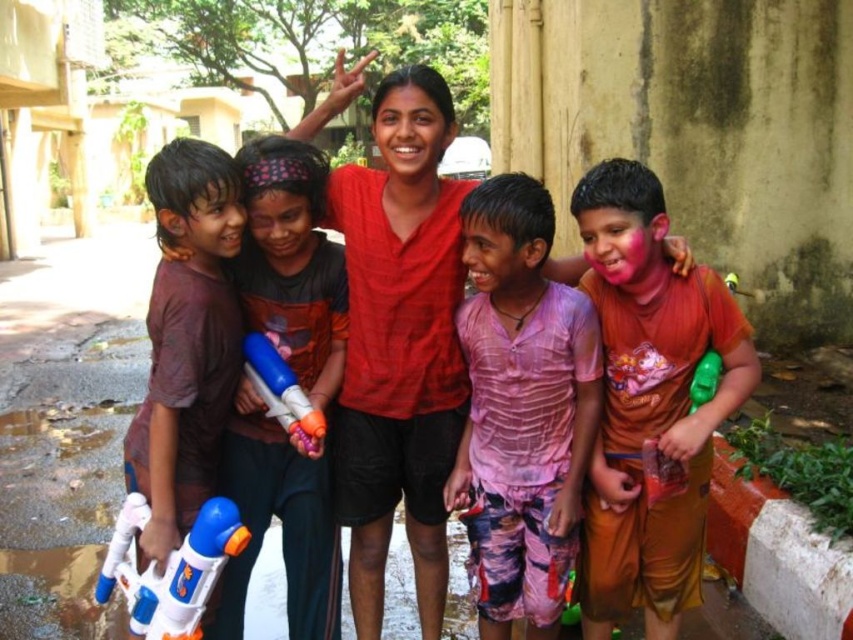
Can you confirm if orange fabric shirt at center is taller than blue plastic water gun at center?

Correct, orange fabric shirt at center is much taller as blue plastic water gun at center.

Does orange fabric shirt at center have a lesser height compared to blue plastic water gun at center?

In fact, orange fabric shirt at center may be taller than blue plastic water gun at center.

Does point (584, 284) come closer to viewer compared to point (265, 349)?

No, it is behind (265, 349).

The image size is (853, 640). What are the coordinates of `orange fabric shirt at center` in the screenshot? It's located at (648, 404).

Is point (210, 312) positioned after point (296, 380)?

No, (210, 312) is closer to viewer.

Image resolution: width=853 pixels, height=640 pixels. Find the location of `brown matte water gun at left`. brown matte water gun at left is located at coordinates (187, 339).

Locate an element on the screen. The height and width of the screenshot is (640, 853). brown matte water gun at left is located at coordinates (187, 339).

Where is `brown matte water gun at left`? brown matte water gun at left is located at coordinates (187, 339).

Who is higher up, pink fabric shirt at center or matte brown shirt at center?

matte brown shirt at center is above.

Does point (554, 429) come behind point (257, 547)?

No, it is not.

Does point (506, 544) come behind point (242, 513)?

No, it is in front of (242, 513).

You are a GUI agent. You are given a task and a screenshot of the screen. Output one action in this format:
    pyautogui.click(x=<x>, y=<y>)
    Task: Click on the pink fabric shirt at center
    
    Given the screenshot: What is the action you would take?
    pyautogui.click(x=521, y=410)